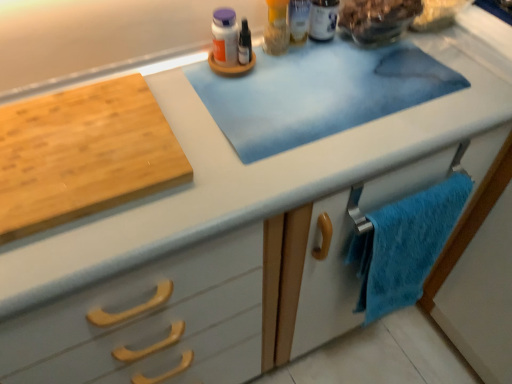
Locate an element on the screen. free location to the right of white plastic bottle at upper center, marked as the 1th toiletry in a right-to-left arrangement is located at coordinates (408, 51).